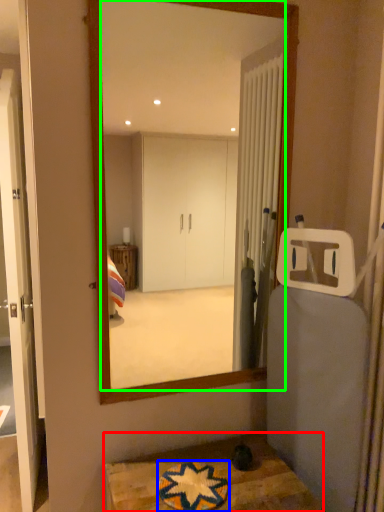
Question: Based on their relative distances, which object is nearer to table (highlighted by a red box)? Choose from bath mat (highlighted by a blue box) and mirror (highlighted by a green box).

Choices:
 (A) bath mat
 (B) mirror

Answer: (A)